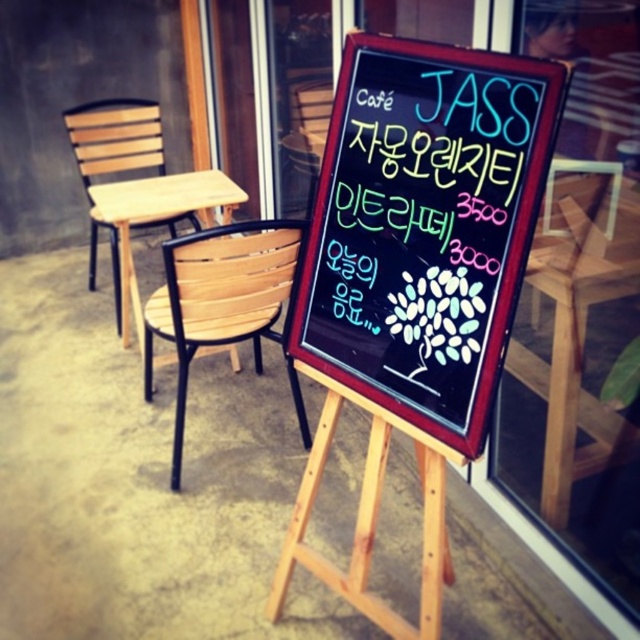
Can you confirm if black chalkboard at center is taller than wooden slats at left?

No.

From the picture: Can you confirm if black chalkboard at center is bigger than wooden slats at left?

No, black chalkboard at center is not bigger than wooden slats at left.

Find the location of a particular element. The width and height of the screenshot is (640, 640). black chalkboard at center is located at coordinates (424, 227).

Locate an element on the screen. black chalkboard at center is located at coordinates point(424,227).

Does wooden chair at center have a lesser width compared to wooden at center?

Yes, wooden chair at center is thinner than wooden at center.

Is wooden chair at center above wooden at center?

Correct, wooden chair at center is located above wooden at center.

Between point (566, 250) and point (289, 248), which one is positioned behind?

The point (289, 248) is behind.

This screenshot has height=640, width=640. I want to click on wooden chair at center, so click(579, 332).

Is wooden at center smaller than wooden slats at left?

Indeed, wooden at center has a smaller size compared to wooden slats at left.

From the picture: Who is shorter, wooden at center or wooden slats at left?

Standing shorter between the two is wooden at center.

Where is `wooden at center`? The height and width of the screenshot is (640, 640). wooden at center is located at coordinates (220, 298).

Find the location of a particular element. The image size is (640, 640). wooden at center is located at coordinates (220, 298).